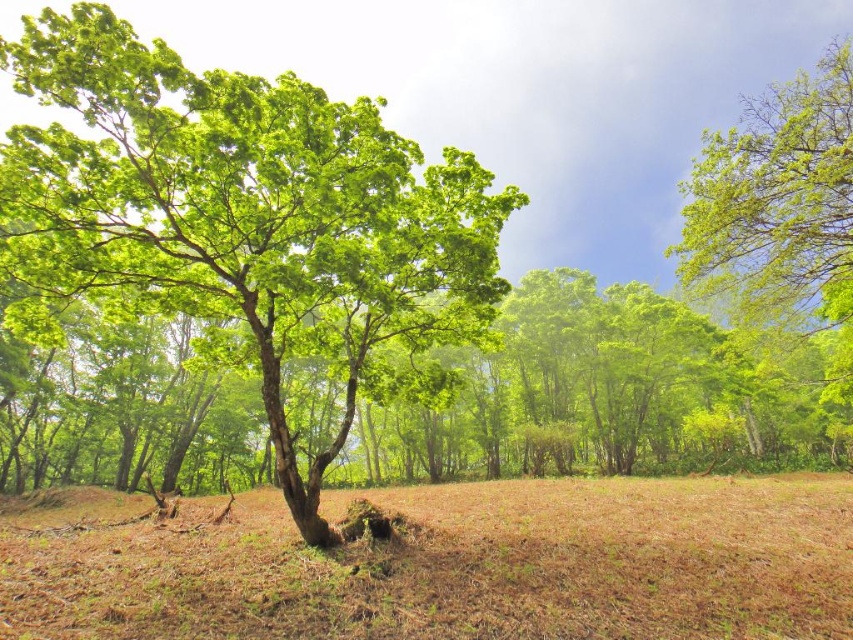
Question: Which point appears farthest from the camera in this image?

Choices:
 (A) click(x=177, y=621)
 (B) click(x=18, y=67)
 (C) click(x=846, y=248)

Answer: (C)

Question: Which of the following is the closest to the observer?

Choices:
 (A) (111, 209)
 (B) (16, 595)

Answer: (B)

Question: Estimate the real-world distances between objects in this image. Which object is closer to the green leafy tree at center?

Choices:
 (A) brown dry grass at center
 (B) green leafy tree at upper right

Answer: (A)

Question: Does brown dry grass at center have a larger size compared to green leafy tree at upper right?

Choices:
 (A) yes
 (B) no

Answer: (B)

Question: In this image, where is green leafy tree at center located relative to green leafy tree at upper right?

Choices:
 (A) below
 (B) above

Answer: (A)

Question: Observing the image, what is the correct spatial positioning of brown dry grass at center in reference to green leafy tree at upper right?

Choices:
 (A) below
 (B) above

Answer: (A)